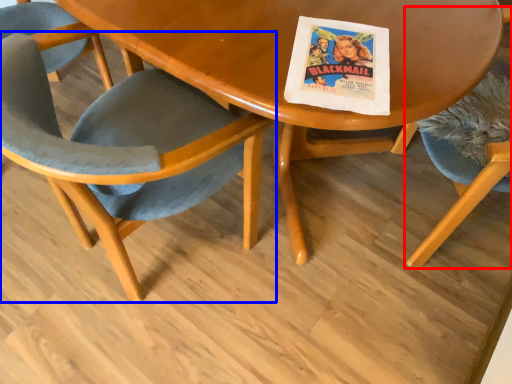
Question: Which object is closer to the camera taking this photo, chair (highlighted by a red box) or chair (highlighted by a blue box)?

Choices:
 (A) chair
 (B) chair

Answer: (B)